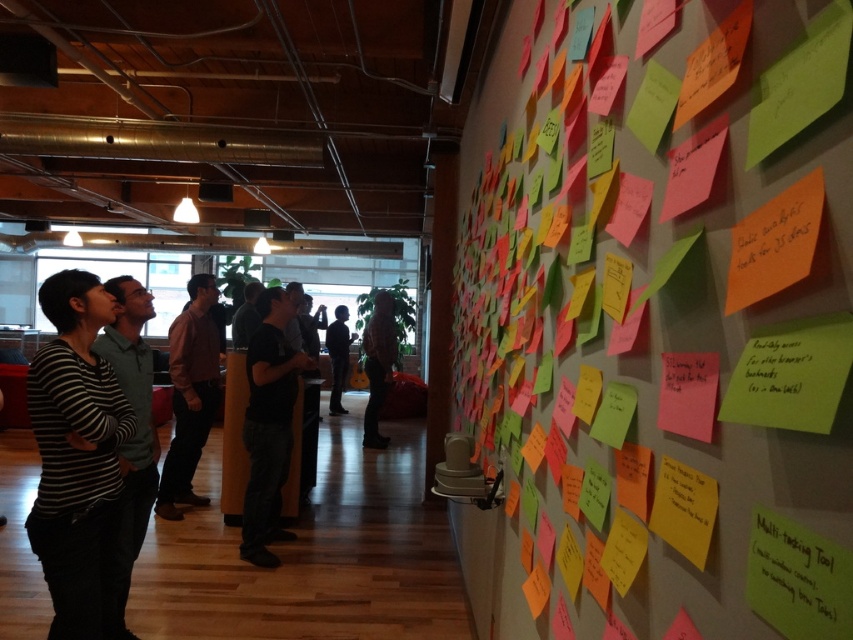
Who is higher up, black striped shirt at left or pink shirt at center?

black striped shirt at left is above.

Based on the photo, can you confirm if black striped shirt at left is taller than pink shirt at center?

No, black striped shirt at left is not taller than pink shirt at center.

Measure the distance between point (x=91, y=360) and camera.

Point (x=91, y=360) and camera are 7.87 feet apart.

You are a GUI agent. You are given a task and a screenshot of the screen. Output one action in this format:
    pyautogui.click(x=<x>, y=<y>)
    Task: Click on the black striped shirt at left
    
    Given the screenshot: What is the action you would take?
    pyautogui.click(x=74, y=454)

Is colorful sticky notes at upper right shorter than pink shirt at center?

In fact, colorful sticky notes at upper right may be taller than pink shirt at center.

Which is in front, point (688, 497) or point (198, 406)?

Point (688, 497)

Describe the element at coordinates (653, 321) in the screenshot. I see `colorful sticky notes at upper right` at that location.

I want to click on colorful sticky notes at upper right, so click(x=653, y=321).

Is black matte shirt at center to the left of pink shirt at center from the viewer's perspective?

Incorrect, black matte shirt at center is not on the left side of pink shirt at center.

Is point (268, 406) behind point (196, 412)?

That is False.

Where is `black matte shirt at center`? The image size is (853, 640). black matte shirt at center is located at coordinates (268, 426).